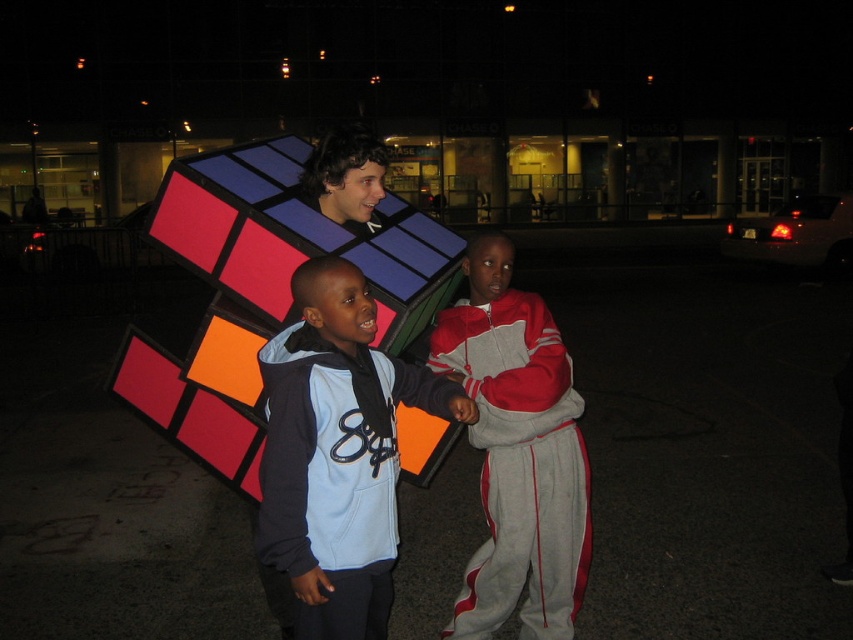
You are a photographer trying to capture a group photo of the light blue fleece jacket at center and the gray fleece tracksuit at center. To ensure both are fully visible in the frame, which clothing item should you focus on first to avoid cropping the bottom of the taller one?

The gray fleece tracksuit at center is taller than the light blue fleece jacket at center. Focus on the gray fleece tracksuit at center first to avoid cropping its bottom.